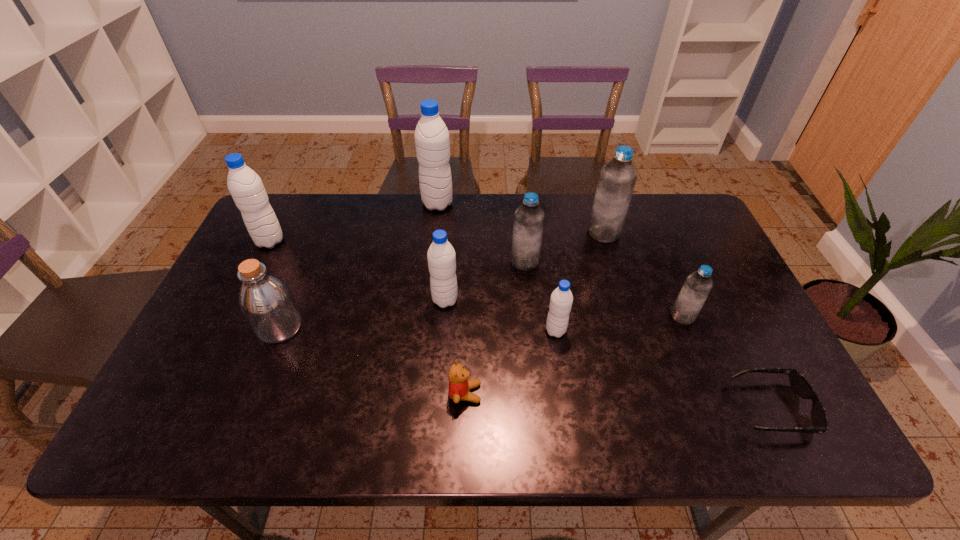
Point out which water bottle is positioned as the fourth nearest to the second biggest gray water bottle. Please provide its 2D coordinates. Your answer should be formatted as a tuple, i.e. [(x, y)], where the tuple contains the x and y coordinates of a point satisfying the conditions above.

[(561, 300)]

Where is `water bottle that stands as the second closest to the shortest object`? The height and width of the screenshot is (540, 960). water bottle that stands as the second closest to the shortest object is located at coordinates pyautogui.click(x=561, y=300).

Locate an element on the screen. Image resolution: width=960 pixels, height=540 pixels. gray water bottle that stands as the second closest to the teddy bear is located at coordinates (441, 256).

Locate which gray water bottle is the closest to the rightmost blue water bottle. Please provide its 2D coordinates. Your answer should be formatted as a tuple, i.e. [(x, y)], where the tuple contains the x and y coordinates of a point satisfying the conditions above.

[(561, 300)]

Locate which blue water bottle ranks second in proximity to the third smallest gray water bottle. Please provide its 2D coordinates. Your answer should be formatted as a tuple, i.e. [(x, y)], where the tuple contains the x and y coordinates of a point satisfying the conditions above.

[(617, 180)]

Select which blue water bottle is the third closest to the second nearest gray water bottle. Please provide its 2D coordinates. Your answer should be formatted as a tuple, i.e. [(x, y)], where the tuple contains the x and y coordinates of a point satisfying the conditions above.

[(694, 293)]